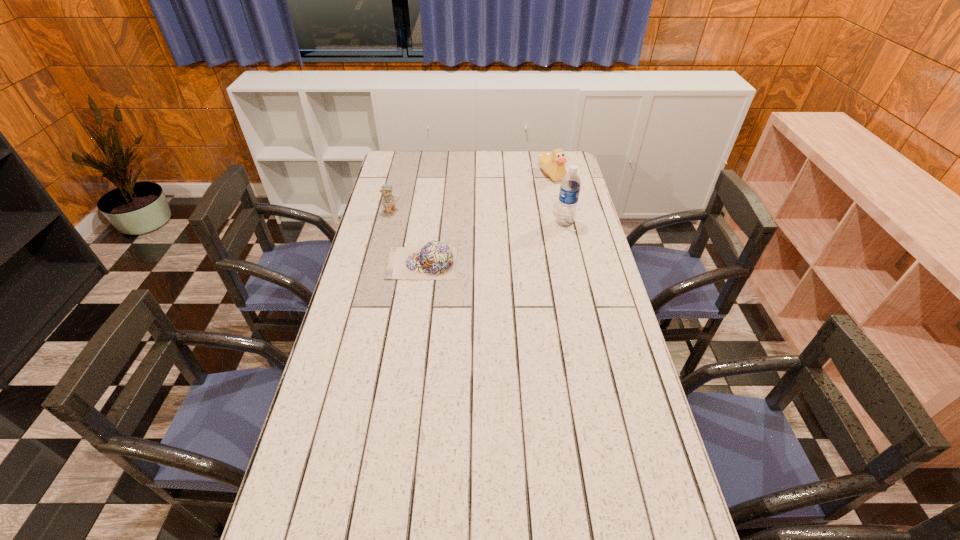
The height and width of the screenshot is (540, 960). In order to click on free space located on the front-facing side of the second farthest object in this screenshot , I will do [439, 232].

The width and height of the screenshot is (960, 540). In order to click on vacant area located 0.090m on the front-facing side of the second farthest object in this screenshot , I will do pyautogui.click(x=415, y=222).

Where is `free space located at the beak of the duck`? The height and width of the screenshot is (540, 960). free space located at the beak of the duck is located at coordinates (541, 196).

You are a GUI agent. You are given a task and a screenshot of the screen. Output one action in this format:
    pyautogui.click(x=<x>, y=<y>)
    Task: Click on the free space located 0.360m at the beak of the duck
    The width and height of the screenshot is (960, 540).
    Given the screenshot: What is the action you would take?
    pyautogui.click(x=521, y=229)

You are a GUI agent. You are given a task and a screenshot of the screen. Output one action in this format:
    pyautogui.click(x=<x>, y=<y>)
    Task: Click on the vacant space located 0.300m at the beak of the duck
    
    Given the screenshot: What is the action you would take?
    pyautogui.click(x=527, y=220)

This screenshot has width=960, height=540. Identify the location of object that is at the far edge. (552, 164).

The image size is (960, 540). Identify the location of cap present at the left edge. (436, 260).

Locate an element on the screen. This screenshot has height=540, width=960. teddy bear positioned at the left edge is located at coordinates (389, 200).

Identify the location of water bottle present at the right edge. Image resolution: width=960 pixels, height=540 pixels. (570, 186).

Locate an element on the screen. duck that is at the right edge is located at coordinates (552, 164).